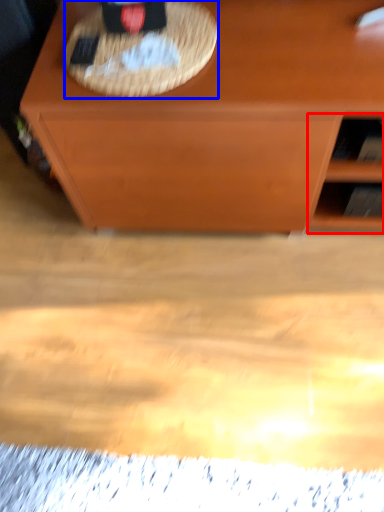
Question: Which point is closer to the camera, shelf (highlighted by a red box) or picnic basket (highlighted by a blue box)?

Choices:
 (A) shelf
 (B) picnic basket

Answer: (B)